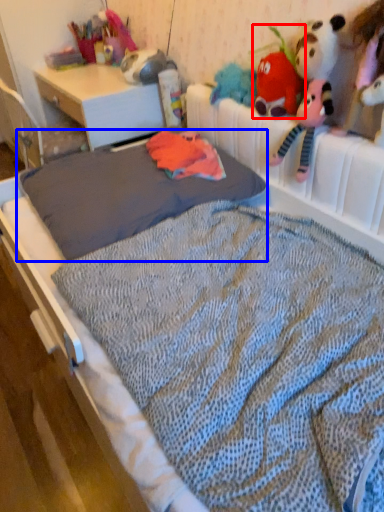
Question: Which object is further to the camera taking this photo, toy (highlighted by a red box) or mattress (highlighted by a blue box)?

Choices:
 (A) toy
 (B) mattress

Answer: (A)